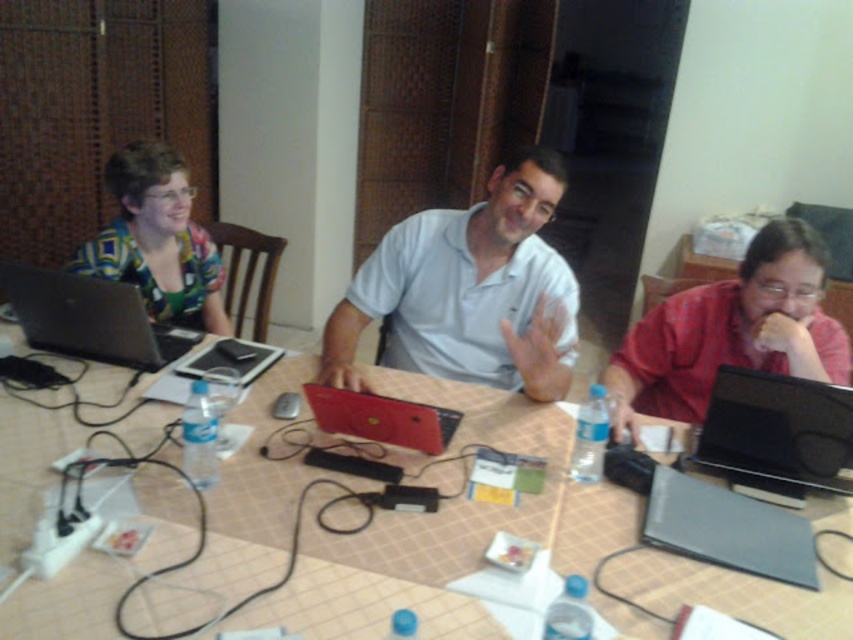
You are organizing a small gathering and need to place a 1.2 meter long banner on the table. Given the objects present, can the brown tile table at center accommodate the banner without overlapping the red matte shirt at right?

The brown tile table at center is larger in size than red matte shirt at right, so it is possible that the banner could fit. However, the exact placement and space between them would depend on the table dimensions and the shirt position.

Consider the image. You are standing at the origin point of the coordinate system in the image. There is a matte multicolored shirt at upper left located at point (157, 240). If you move 0.1 units to the right and 0.05 units down from your current position, will you be closer to or farther from the matte multicolored shirt at upper left?

Moving 0.1 units to the right and 0.05 units down from the origin would bring you to the new coordinates 0.1, 0.05. The original position of the matte multicolored shirt at upper left is at (157, 240). Comparing distances, the distance from the origin to the shirt is sqrt0.37520.1852. After moving, the distance becomes sqrt0.27520.1352. Since both x and y distances have decreased, you would be closer to the matte multicolored shirt at upper left.